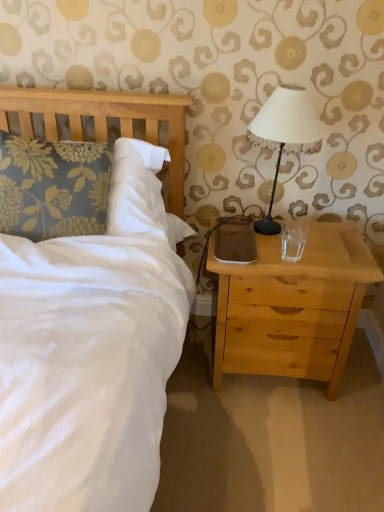
Image resolution: width=384 pixels, height=512 pixels. What are the coordinates of `free location in front of transparent glass at right` in the screenshot? It's located at (304, 272).